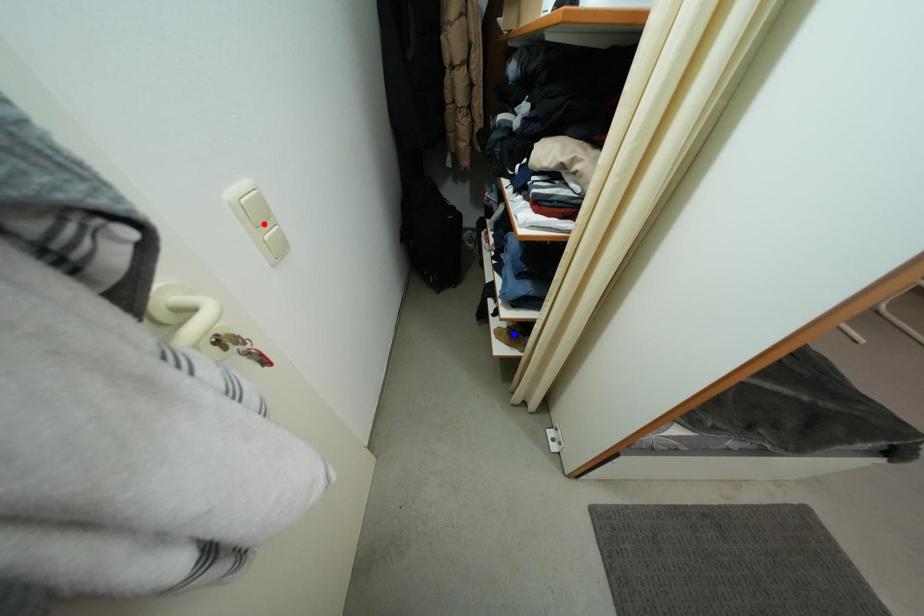
Question: Two points are marked on the image. Which point is closer to the camera?

Choices:
 (A) Blue point is closer.
 (B) Red point is closer.

Answer: (B)